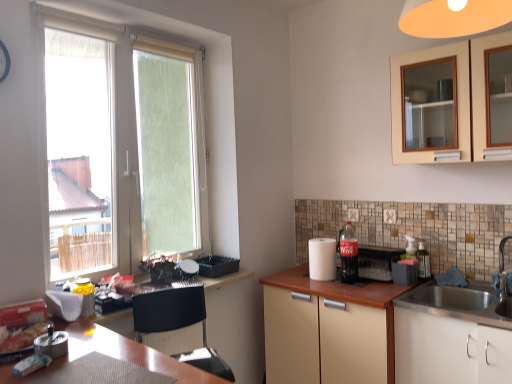
Locate an element on the screen. This screenshot has width=512, height=384. vacant area in front of black plastic soda at center, marked as the 2th appliance in a left-to-right arrangement is located at coordinates (366, 289).